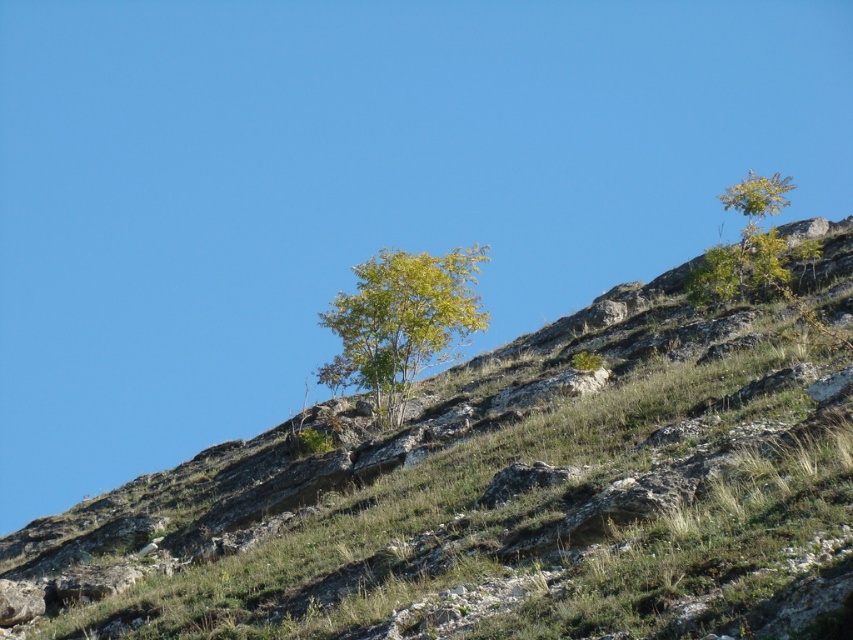
Question: Which object is positioned closest to the green leafy tree at upper right?

Choices:
 (A) green grassy hillside at upper center
 (B) green leafy tree at center

Answer: (B)

Question: Does green grassy hillside at upper center appear over green leafy tree at center?

Choices:
 (A) yes
 (B) no

Answer: (B)

Question: Which object is the farthest from the green leafy tree at center?

Choices:
 (A) green grassy hillside at upper center
 (B) green leafy tree at upper right

Answer: (B)

Question: Which point is farther from the camera taking this photo?

Choices:
 (A) (469, 275)
 (B) (738, 211)
 (C) (416, 486)

Answer: (B)

Question: Is green grassy hillside at upper center to the right of green leafy tree at upper right from the viewer's perspective?

Choices:
 (A) no
 (B) yes

Answer: (A)

Question: Does green leafy tree at center have a lesser width compared to green leafy tree at upper right?

Choices:
 (A) yes
 (B) no

Answer: (A)